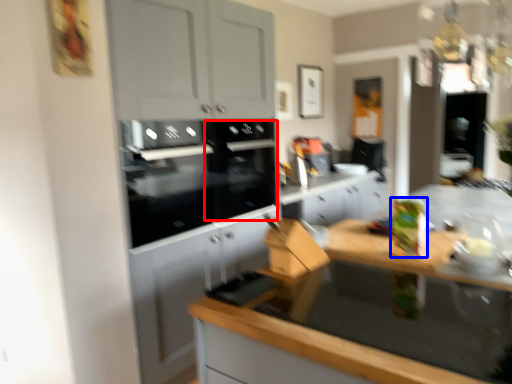
Question: Which of the following is the closest to the observer, appliance (highlighted by a red box) or appliance (highlighted by a blue box)?

Choices:
 (A) appliance
 (B) appliance

Answer: (B)